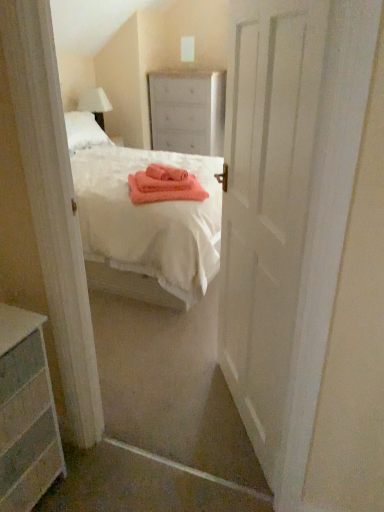
This screenshot has width=384, height=512. Describe the element at coordinates (26, 413) in the screenshot. I see `gray striped dresser at lower left` at that location.

In order to click on white matte door at center in this screenshot , I will do `click(305, 247)`.

The image size is (384, 512). Describe the element at coordinates (305, 247) in the screenshot. I see `white matte door at center` at that location.

Locate an element on the screen. The image size is (384, 512). white wood dresser at upper center is located at coordinates (187, 112).

Considering the sizes of white fabric lampshade at upper left and gray striped dresser at lower left in the image, is white fabric lampshade at upper left wider or thinner than gray striped dresser at lower left?

white fabric lampshade at upper left is thinner than gray striped dresser at lower left.

Between white fabric lampshade at upper left and gray striped dresser at lower left, which one is positioned in front?

gray striped dresser at lower left is more forward.

Locate an element on the screen. lamp behind the gray striped dresser at lower left is located at coordinates (95, 104).

Can you confirm if white fabric lampshade at upper left is taller than gray striped dresser at lower left?

No, white fabric lampshade at upper left is not taller than gray striped dresser at lower left.

Who is smaller, gray striped dresser at lower left or white fabric lampshade at upper left?

Smaller between the two is white fabric lampshade at upper left.

Identify the location of the chest of drawers lying below the white fabric lampshade at upper left (from the image's perspective). The height and width of the screenshot is (512, 384). [26, 413].

From the image's perspective, between gray striped dresser at lower left and white fabric lampshade at upper left, which one is located above?

white fabric lampshade at upper left.

How much distance is there between gray striped dresser at lower left and white fabric lampshade at upper left?

A distance of 11.81 feet exists between gray striped dresser at lower left and white fabric lampshade at upper left.

Which of these two, white wood dresser at upper center or gray striped dresser at lower left, is thinner?

gray striped dresser at lower left is thinner.

Is point (158, 111) positioned before point (12, 361)?

No, (158, 111) is further to viewer.

Locate an element on the screen. nightstand behind the gray striped dresser at lower left is located at coordinates (187, 112).

From a real-world perspective, who is located lower, white wood dresser at upper center or gray striped dresser at lower left?

In real-world perspective, gray striped dresser at lower left is lower.

Considering the positions of objects white matte door at center and white wood dresser at upper center in the image provided, who is more to the left, white matte door at center or white wood dresser at upper center?

white wood dresser at upper center is more to the left.

What's the angular difference between white matte door at center and white wood dresser at upper center's facing directions?

The angular difference between white matte door at center and white wood dresser at upper center is 55.6 degrees.

From the image's perspective, relative to white wood dresser at upper center, is white matte door at center above or below?

Clearly, from the image's perspective, white matte door at center is below white wood dresser at upper center.

Is white matte door at center inside or outside of white wood dresser at upper center?

white matte door at center cannot be found inside white wood dresser at upper center.

Considering the sizes of objects white fabric lampshade at upper left and white matte door at center in the image provided, who is taller, white fabric lampshade at upper left or white matte door at center?

white matte door at center is taller.

Between white fabric lampshade at upper left and white matte door at center, which one is positioned behind?

white fabric lampshade at upper left is behind.

From a real-world perspective, who is located lower, white fabric lampshade at upper left or white matte door at center?

white matte door at center is physically lower.

At what (x,y) coordinates should I click in order to perform the action: click on door below the white fabric lampshade at upper left (from the image's perspective). Please return your answer as a coordinate pair (x, y). Image resolution: width=384 pixels, height=512 pixels. Looking at the image, I should click on (305, 247).

How different are the orientations of white wood dresser at upper center and white fabric lampshade at upper left in degrees?

There is a 90-degree angle between the facing directions of white wood dresser at upper center and white fabric lampshade at upper left.

Does white wood dresser at upper center have a lesser width compared to white fabric lampshade at upper left?

Incorrect, the width of white wood dresser at upper center is not less than that of white fabric lampshade at upper left.

Is white wood dresser at upper center far from white fabric lampshade at upper left?

They are positioned close to each other.

From the image's perspective, would you say white wood dresser at upper center is positioned over white fabric lampshade at upper left?

Correct, white wood dresser at upper center appears higher than white fabric lampshade at upper left in the image.

Does gray striped dresser at lower left appear on the left side of white matte door at center?

Yes.

From a real-world perspective, who is located higher, gray striped dresser at lower left or white matte door at center?

In real-world perspective, white matte door at center is above.

Does gray striped dresser at lower left lie behind white matte door at center?

Yes, gray striped dresser at lower left is further from the camera.

Is gray striped dresser at lower left far from white matte door at center?

gray striped dresser at lower left is near white matte door at center, not far away.

The image size is (384, 512). What are the coordinates of `chest of drawers below the white fabric lampshade at upper left (from a real-world perspective)` in the screenshot? It's located at (26, 413).

There is a gray striped dresser at lower left. Where is `lamp above it (from a real-world perspective)`? lamp above it (from a real-world perspective) is located at coordinates (95, 104).

From the image, which object appears to be nearer to white wood dresser at upper center, gray striped dresser at lower left or white matte door at center?

white matte door at center is positioned closer to the anchor white wood dresser at upper center.

Looking at the image, which one is located further to white matte door at center, white fabric lampshade at upper left or white wood dresser at upper center?

Based on the image, white fabric lampshade at upper left appears to be further to white matte door at center.

Looking at the image, which one is located closer to white matte door at center, white wood dresser at upper center or white fabric lampshade at upper left?

white wood dresser at upper center lies closer to white matte door at center than the other object.

From the image, which object appears to be nearer to white fabric lampshade at upper left, white wood dresser at upper center or gray striped dresser at lower left?

The object closer to white fabric lampshade at upper left is white wood dresser at upper center.

Looking at the image, which one is located further to white wood dresser at upper center, white matte door at center or gray striped dresser at lower left?

Among the two, gray striped dresser at lower left is located further to white wood dresser at upper center.

Looking at the image, which one is located further to gray striped dresser at lower left, white fabric lampshade at upper left or white matte door at center?

white fabric lampshade at upper left is further to gray striped dresser at lower left.

Estimate the real-world distances between objects in this image. Which object is closer to white matte door at center, white wood dresser at upper center or gray striped dresser at lower left?

The object closer to white matte door at center is gray striped dresser at lower left.

Looking at this image, based on their spatial positions, is white matte door at center or white wood dresser at upper center closer to gray striped dresser at lower left?

Among the two, white matte door at center is located nearer to gray striped dresser at lower left.

Where is `lamp positioned between white matte door at center and white wood dresser at upper center from near to far`? The height and width of the screenshot is (512, 384). lamp positioned between white matte door at center and white wood dresser at upper center from near to far is located at coordinates (95, 104).

Image resolution: width=384 pixels, height=512 pixels. In order to click on lamp between gray striped dresser at lower left and white wood dresser at upper center in the front-back direction in this screenshot , I will do `click(95, 104)`.

Identify the location of chest of drawers between white matte door at center and white fabric lampshade at upper left along the z-axis. (26, 413).

You are a GUI agent. You are given a task and a screenshot of the screen. Output one action in this format:
    pyautogui.click(x=<x>, y=<y>)
    Task: Click on the chest of drawers located between white matte door at center and white wood dresser at upper center in the depth direction
    
    Given the screenshot: What is the action you would take?
    pyautogui.click(x=26, y=413)